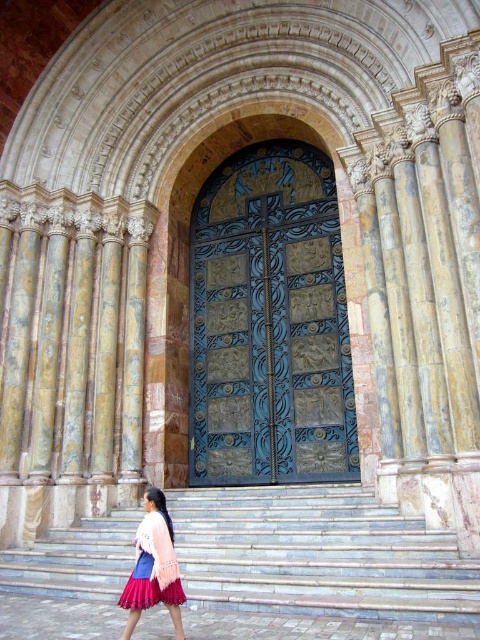
Is smooth stone stairs at center closer to the viewer compared to pink knitted sweater at lower left?

No, it is behind pink knitted sweater at lower left.

Does smooth stone stairs at center have a larger size compared to pink knitted sweater at lower left?

Yes.

The width and height of the screenshot is (480, 640). Find the location of `smooth stone stairs at center`. smooth stone stairs at center is located at coordinates (317, 554).

The width and height of the screenshot is (480, 640). In order to click on smooth stone stairs at center in this screenshot , I will do `click(317, 554)`.

Describe the element at coordinates (269, 323) in the screenshot. I see `blue patinated metal door at center` at that location.

Is blue patinated metal door at center smaller than pink knitted sweater at lower left?

Actually, blue patinated metal door at center might be larger than pink knitted sweater at lower left.

Measure the distance between point (x=344, y=392) and camera.

Point (x=344, y=392) and camera are 42.34 meters apart from each other.

Image resolution: width=480 pixels, height=640 pixels. In order to click on blue patinated metal door at center in this screenshot , I will do `click(269, 323)`.

Is blue patinated metal door at center above smooth stone stairs at center?

Indeed, blue patinated metal door at center is positioned over smooth stone stairs at center.

Is blue patinated metal door at center to the left of smooth stone stairs at center from the viewer's perspective?

No, blue patinated metal door at center is not to the left of smooth stone stairs at center.

Between point (208, 182) and point (261, 499), which one is positioned behind?

Positioned behind is point (208, 182).

I want to click on blue patinated metal door at center, so tap(269, 323).